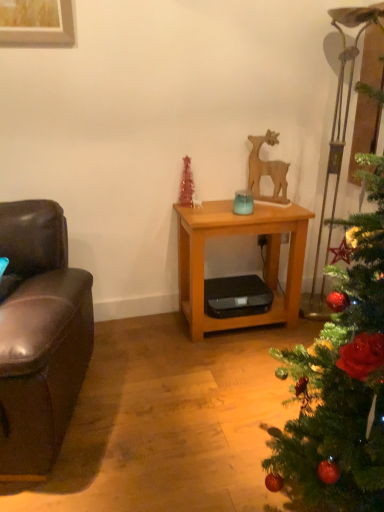
Question: Can you confirm if brown leather couch at left is wider than wooden table at center?

Choices:
 (A) no
 (B) yes

Answer: (B)

Question: Is wooden table at center at the back of brown leather couch at left?

Choices:
 (A) no
 (B) yes

Answer: (A)

Question: Considering the relative positions of brown leather couch at left and wooden table at center in the image provided, is brown leather couch at left in front of wooden table at center?

Choices:
 (A) no
 (B) yes

Answer: (B)

Question: Are brown leather couch at left and wooden table at center far apart?

Choices:
 (A) no
 (B) yes

Answer: (A)

Question: Does brown leather couch at left have a lesser width compared to wooden table at center?

Choices:
 (A) yes
 (B) no

Answer: (B)

Question: From a real-world perspective, is brown leather couch at left physically below wooden table at center?

Choices:
 (A) yes
 (B) no

Answer: (B)

Question: Is wooden table at center not inside green matte christmas tree at right?

Choices:
 (A) no
 (B) yes

Answer: (B)

Question: Is wooden table at center bigger than green matte christmas tree at right?

Choices:
 (A) no
 (B) yes

Answer: (A)

Question: Is wooden table at center to the right of green matte christmas tree at right from the viewer's perspective?

Choices:
 (A) no
 (B) yes

Answer: (A)

Question: Considering the relative sizes of wooden table at center and green matte christmas tree at right in the image provided, is wooden table at center thinner than green matte christmas tree at right?

Choices:
 (A) yes
 (B) no

Answer: (A)

Question: From a real-world perspective, is wooden table at center physically above green matte christmas tree at right?

Choices:
 (A) yes
 (B) no

Answer: (B)

Question: Is the depth of wooden table at center less than that of green matte christmas tree at right?

Choices:
 (A) no
 (B) yes

Answer: (A)

Question: Is wooden deer at center next to wooden table at center and touching it?

Choices:
 (A) no
 (B) yes

Answer: (A)